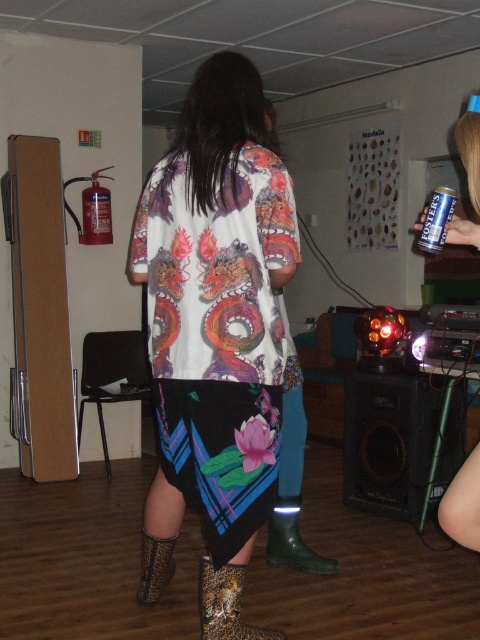
Question: Which point is farther to the camera?

Choices:
 (A) (472, 184)
 (B) (452, 189)
 (C) (160, 554)
 (D) (204, 611)

Answer: (B)

Question: Which point is closer to the camera taking this photo?

Choices:
 (A) (144, 554)
 (B) (261, 636)

Answer: (B)

Question: Which point is farther from the camera taking this photo?

Choices:
 (A) (301, 557)
 (B) (165, 554)

Answer: (A)

Question: Is leopard print fabric boot at lower center further to the viewer compared to silver metallic can at upper right?

Choices:
 (A) no
 (B) yes

Answer: (B)

Question: Is the position of printed fabric dress at center more distant than that of metallic silver can at upper right?

Choices:
 (A) no
 (B) yes

Answer: (B)

Question: Can you confirm if leopard print boot at lower left is wider than silver metallic can at upper right?

Choices:
 (A) no
 (B) yes

Answer: (B)